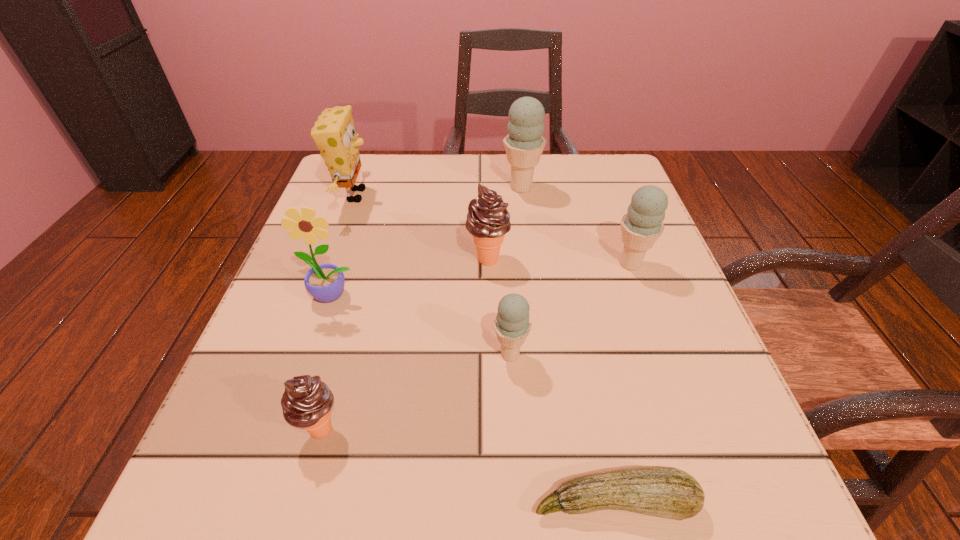
I want to click on unoccupied position between the sponge and the left chocolate icecream, so click(x=338, y=312).

Identify the location of blank region between the shortest object and the farthest icecream. (567, 345).

Where is `vacant point located between the green zucchini and the fifth farthest object`? vacant point located between the green zucchini and the fifth farthest object is located at coordinates (473, 399).

In order to click on vacant area between the nearest blue ice cream and the sunflower in this screenshot , I will do `click(421, 325)`.

Find the location of a particular element. vacant point located between the right chocolate icecream and the shortest object is located at coordinates (551, 380).

The image size is (960, 540). Find the location of `vacant space in between the fourth nearest object and the nearest blue ice cream`. vacant space in between the fourth nearest object and the nearest blue ice cream is located at coordinates (421, 325).

The image size is (960, 540). In order to click on vacant space in between the rightmost icecream and the fourth nearest object in this screenshot , I will do `click(482, 280)`.

The width and height of the screenshot is (960, 540). Find the location of `vacant space in between the tallest icecream and the shortest object`. vacant space in between the tallest icecream and the shortest object is located at coordinates (567, 345).

This screenshot has height=540, width=960. I want to click on object that is the second nearest to the bigger chocolate icecream, so click(x=524, y=144).

You are a GUI agent. You are given a task and a screenshot of the screen. Output one action in this format:
    pyautogui.click(x=<x>, y=<y>)
    Task: Click on the sixth closest object relative to the zucchini
    
    Given the screenshot: What is the action you would take?
    pyautogui.click(x=335, y=136)